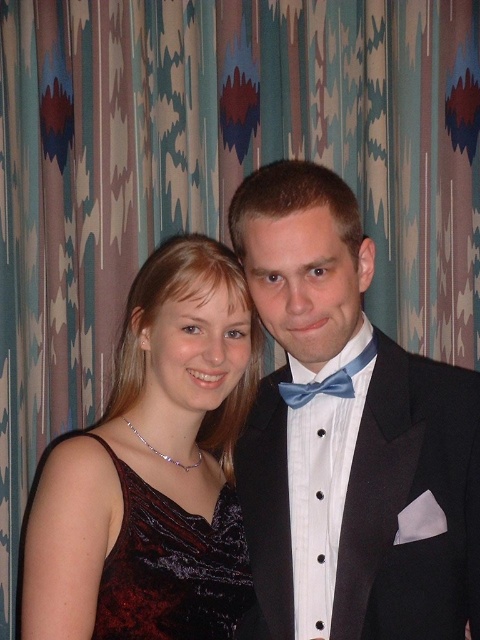
Does velvet dress at left have a greater width compared to blue satin bow tie at center?

Yes.

How distant is velvet dress at left from blue satin bow tie at center?

A distance of 9.10 inches exists between velvet dress at left and blue satin bow tie at center.

This screenshot has width=480, height=640. What do you see at coordinates (154, 467) in the screenshot?
I see `velvet dress at left` at bounding box center [154, 467].

You are a GUI agent. You are given a task and a screenshot of the screen. Output one action in this format:
    pyautogui.click(x=<x>, y=<y>)
    Task: Click on the velvet dress at left
    This screenshot has height=640, width=480.
    Given the screenshot: What is the action you would take?
    pyautogui.click(x=154, y=467)

Is satin black suit at center to the left of velvet dark red dress at center from the viewer's perspective?

In fact, satin black suit at center is to the right of velvet dark red dress at center.

Which is below, satin black suit at center or velvet dark red dress at center?

velvet dark red dress at center is below.

Describe the element at coordinates (348, 436) in the screenshot. The height and width of the screenshot is (640, 480). I see `satin black suit at center` at that location.

Where is `satin black suit at center`? satin black suit at center is located at coordinates (348, 436).

Does point (205, 566) lie in front of point (300, 385)?

Yes, it is in front of point (300, 385).

Is velvet dark red dress at center to the left of blue satin bow tie at center from the viewer's perspective?

Yes, velvet dark red dress at center is to the left of blue satin bow tie at center.

Is point (213, 531) closer to viewer compared to point (296, 388)?

No, it is not.

At what (x,y) coordinates should I click in order to perform the action: click on velvet dark red dress at center. Please return your answer as a coordinate pair (x, y). This screenshot has height=640, width=480. Looking at the image, I should click on (175, 570).